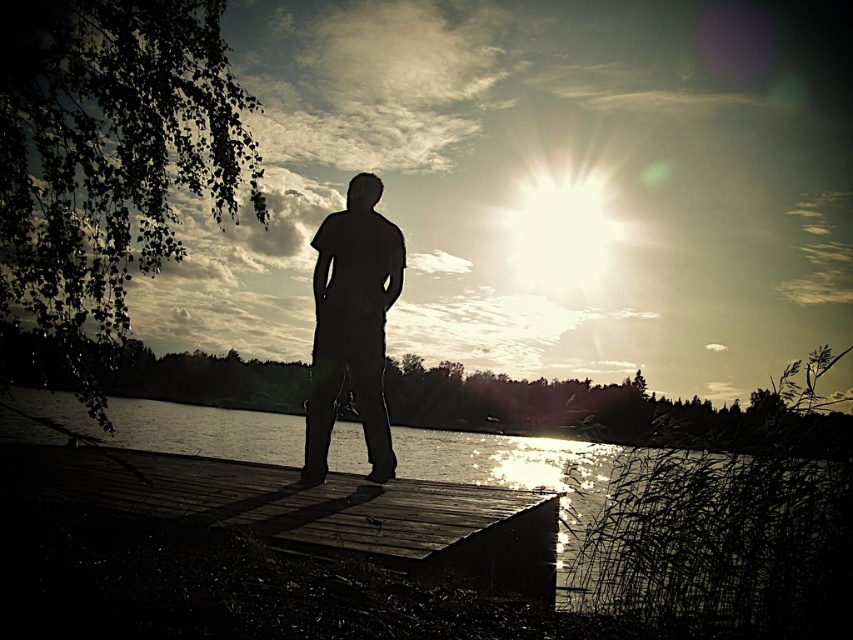
You are standing at the center of the image and want to locate the dark wood dock at center. In which direction should you look to find it?

You should look towards the center of the image to find the dark wood dock at center, as it is located at point (310, 509).

You are standing at the point marked as point (183, 502) in the image. The person on the dock is facing away from you towards the sunset. If you want to approach them without being noticed, which direction should you move relative to your current position?

You should move towards the direction away from the person on the dock since they are facing away from you towards the sunset, so moving further away keeps you out of their line of sight.

In the scene shown: You are a photographer trying to capture the silhouette figure at center and the dark wood dock at center in a single shot. Given that your camera can only focus on one subject at a time, which subject should you prioritize to ensure the other remains in the frame?

The dark wood dock at center is smaller than the silhouette figure at center, so you should prioritize focusing on the silhouette figure at center to ensure the smaller dock stays within the frame.